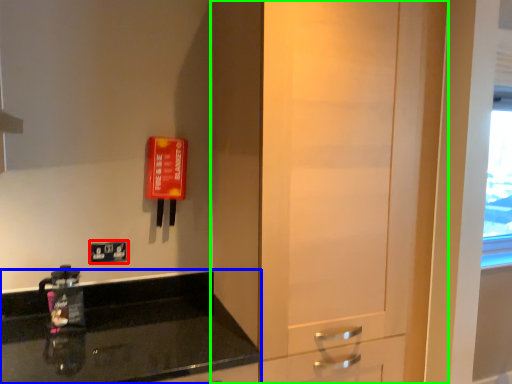
Question: Which object is positioned farthest from light switch (highlighted by a red box)? Select from countertop (highlighted by a blue box) and door (highlighted by a green box).

Choices:
 (A) countertop
 (B) door

Answer: (B)